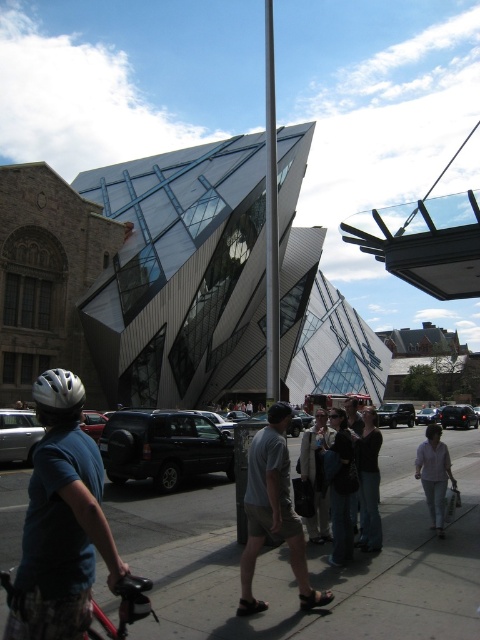
You are standing on the sidewalk and see the glassy steel building at center and the dark blue jeans at center. Which object is positioned to the right of the other?

The glassy steel building at center is to the right of dark blue jeans at center.